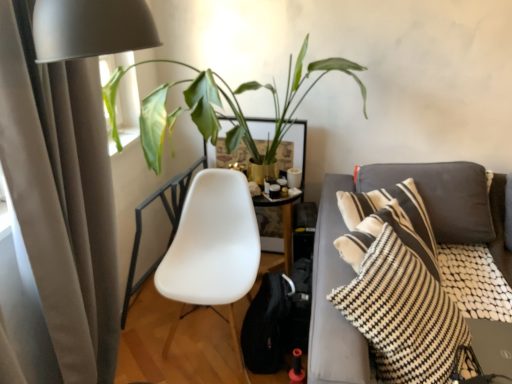
You are a GUI agent. You are given a task and a screenshot of the screen. Output one action in this format:
    pyautogui.click(x=<x>, y=<y>)
    Task: Click on the white plastic chair at center
    This screenshot has height=384, width=512.
    Given the screenshot: What is the action you would take?
    pyautogui.click(x=212, y=248)

You are a GUI agent. You are given a task and a screenshot of the screen. Output one action in this format:
    pyautogui.click(x=<x>, y=<y>)
    Task: Click on the beige fabric curtain at left
    The image size is (512, 384).
    Given the screenshot: What is the action you would take?
    pyautogui.click(x=60, y=200)

In order to face green leafy plant at upper left, should I rotate leftwards or rightwards?

Turn left approximately 1.472 degrees to face it.

What are the coordinates of `white plastic chair at center` in the screenshot? It's located at (212, 248).

Does beige fabric curtain at left turn towards black and white striped pillow at right?

Yes, beige fabric curtain at left is turned towards black and white striped pillow at right.

Is beige fabric curtain at left closer to the viewer compared to black and white striped pillow at right?

Yes, it is in front of black and white striped pillow at right.

Considering the sizes of objects beige fabric curtain at left and black and white striped pillow at right in the image provided, who is shorter, beige fabric curtain at left or black and white striped pillow at right?

black and white striped pillow at right is shorter.

Does point (32, 264) appear closer or farther from the camera than point (439, 334)?

Point (32, 264) is positioned closer to the camera compared to point (439, 334).

Is black and white striped pillow at right in front of or behind green leafy plant at upper left in the image?

black and white striped pillow at right is in front of green leafy plant at upper left.

From a real-world perspective, which is physically above, black and white striped pillow at right or green leafy plant at upper left?

From a 3D spatial view, green leafy plant at upper left is above.

Which object is thinner, black and white striped pillow at right or green leafy plant at upper left?

black and white striped pillow at right.

Can you tell me how much green leafy plant at upper left and white plastic chair at center differ in facing direction?

green leafy plant at upper left and white plastic chair at center are facing 0.0887 degrees away from each other.

Which object is wider, green leafy plant at upper left or white plastic chair at center?

green leafy plant at upper left.

Does green leafy plant at upper left appear on the left side of white plastic chair at center?

In fact, green leafy plant at upper left is to the right of white plastic chair at center.

Which is in front, point (198, 78) or point (207, 170)?

Positioned in front is point (198, 78).

Between green leafy plant at upper left and beige fabric curtain at left, which one appears on the right side from the viewer's perspective?

green leafy plant at upper left.

Is green leafy plant at upper left facing away from beige fabric curtain at left?

No, green leafy plant at upper left is not facing away from beige fabric curtain at left.

Where is `curtain in front of the green leafy plant at upper left`? curtain in front of the green leafy plant at upper left is located at coordinates (60, 200).

Considering the points (17, 87) and (205, 175), which point is behind, point (17, 87) or point (205, 175)?

The point (205, 175) is farther from the camera.

From a real-world perspective, between beige fabric curtain at left and white plastic chair at center, who is vertically higher?

In real-world perspective, beige fabric curtain at left is above.

Find the location of a particular element. The image size is (512, 384). rocking chair behind the beige fabric curtain at left is located at coordinates (212, 248).

Does beige fabric curtain at left come in front of white plastic chair at center?

Yes, it is.

Is green leafy plant at upper left in front of black and white striped pillow at right?

No, the depth of green leafy plant at upper left is greater than that of black and white striped pillow at right.

Considering the sizes of green leafy plant at upper left and black and white striped pillow at right in the image, is green leafy plant at upper left bigger or smaller than black and white striped pillow at right?

In the image, green leafy plant at upper left appears to be larger than black and white striped pillow at right.

Considering the sizes of objects green leafy plant at upper left and black and white striped pillow at right in the image provided, who is shorter, green leafy plant at upper left or black and white striped pillow at right?

With less height is black and white striped pillow at right.

Between green leafy plant at upper left and black and white striped pillow at right, which one has smaller width?

Thinner between the two is black and white striped pillow at right.

Between white plastic chair at center and green leafy plant at upper left, which one is positioned behind?

white plastic chair at center is further away from the camera.

Could you tell me if white plastic chair at center is facing green leafy plant at upper left?

No, white plastic chair at center is not oriented towards green leafy plant at upper left.

Does point (165, 288) come behind point (218, 77)?

No, (165, 288) is closer to viewer.

Can you see white plastic chair at center touching green leafy plant at upper left?

No, white plastic chair at center is not in contact with green leafy plant at upper left.

What are the coordinates of `curtain that appears above the black and white striped pillow at right (from a real-world perspective)` in the screenshot? It's located at (60, 200).

Where is `pillow in front of the green leafy plant at upper left`? pillow in front of the green leafy plant at upper left is located at coordinates (406, 316).

When comparing their distances from beige fabric curtain at left, does white plastic chair at center or black and white striped pillow at right seem further?

black and white striped pillow at right is further to beige fabric curtain at left.

Based on their spatial positions, is green leafy plant at upper left or white plastic chair at center further from beige fabric curtain at left?

Based on the image, green leafy plant at upper left appears to be further to beige fabric curtain at left.

Estimate the real-world distances between objects in this image. Which object is further from beige fabric curtain at left, white plastic chair at center or green leafy plant at upper left?

green leafy plant at upper left is positioned further to the anchor beige fabric curtain at left.

Looking at the image, which one is located closer to beige fabric curtain at left, green leafy plant at upper left or black and white striped pillow at right?

green leafy plant at upper left is positioned closer to the anchor beige fabric curtain at left.

Based on the photo, when comparing their distances from white plastic chair at center, does beige fabric curtain at left or green leafy plant at upper left seem closer?

Based on the image, green leafy plant at upper left appears to be nearer to white plastic chair at center.

Considering their positions, is white plastic chair at center positioned further to green leafy plant at upper left than black and white striped pillow at right?

black and white striped pillow at right.

Based on their spatial positions, is white plastic chair at center or beige fabric curtain at left closer to black and white striped pillow at right?

white plastic chair at center lies closer to black and white striped pillow at right than the other object.

In the scene shown: When comparing their distances from black and white striped pillow at right, does beige fabric curtain at left or green leafy plant at upper left seem closer?

beige fabric curtain at left.

Where is `rocking chair situated between beige fabric curtain at left and black and white striped pillow at right from left to right`? The image size is (512, 384). rocking chair situated between beige fabric curtain at left and black and white striped pillow at right from left to right is located at coordinates (212, 248).

What are the coordinates of `houseplant between beige fabric curtain at left and black and white striped pillow at right from left to right` in the screenshot? It's located at coord(220,106).

This screenshot has height=384, width=512. I want to click on houseplant between white plastic chair at center and black and white striped pillow at right in the horizontal direction, so click(x=220, y=106).

In order to click on houseplant positioned between beige fabric curtain at left and white plastic chair at center from near to far in this screenshot , I will do `click(220, 106)`.